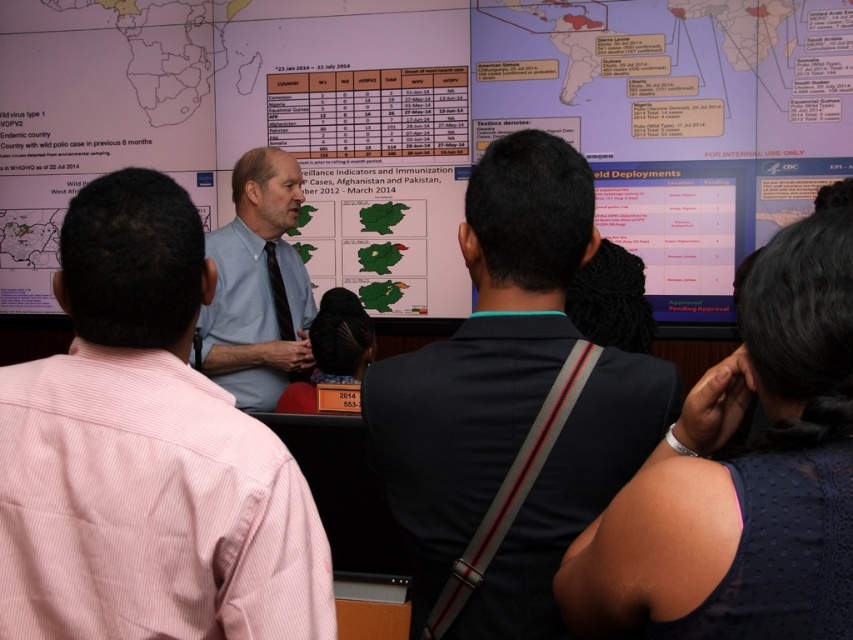
Question: Is matte paper map at upper center thinner than light blue shirt at center?

Choices:
 (A) yes
 (B) no

Answer: (B)

Question: Which point is farther from the camera taking this photo?

Choices:
 (A) (810, 500)
 (B) (543, 140)
 (C) (345, 236)

Answer: (C)

Question: Does light blue shirt at center appear over dark blue shirt at center?

Choices:
 (A) yes
 (B) no

Answer: (B)

Question: Does dark blue shirt at center appear under dark blue textured dress at center?

Choices:
 (A) no
 (B) yes

Answer: (A)

Question: Which of the following is the closest to the observer?

Choices:
 (A) dark blue shirt at center
 (B) dark blue textured dress at center
 (C) light blue shirt at center

Answer: (B)

Question: Based on their relative distances, which object is farther from the light blue shirt at center?

Choices:
 (A) dark blue shirt at center
 (B) blue shirt at center
 (C) dark blue textured dress at center

Answer: (B)